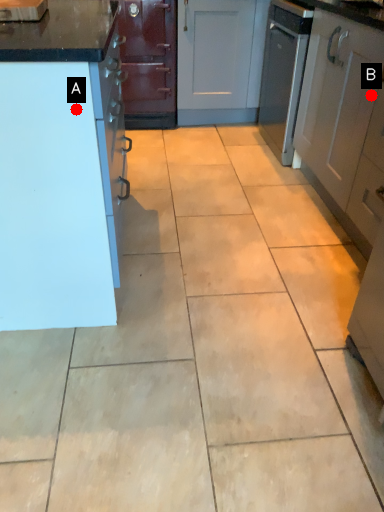
Question: Two points are circled on the image, labeled by A and B beside each circle. Which point is closer to the camera?

Choices:
 (A) A is closer
 (B) B is closer

Answer: (A)